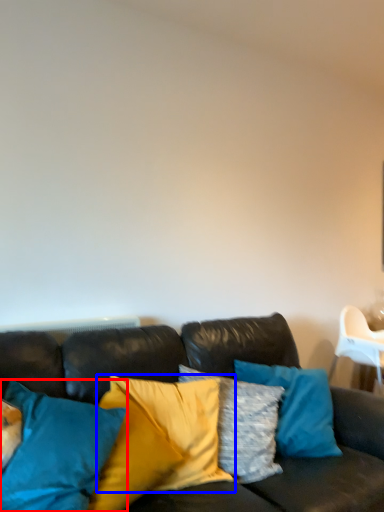
Question: Which of the following is the farthest to the observer, pillow (highlighted by a red box) or pillow (highlighted by a blue box)?

Choices:
 (A) pillow
 (B) pillow

Answer: (B)